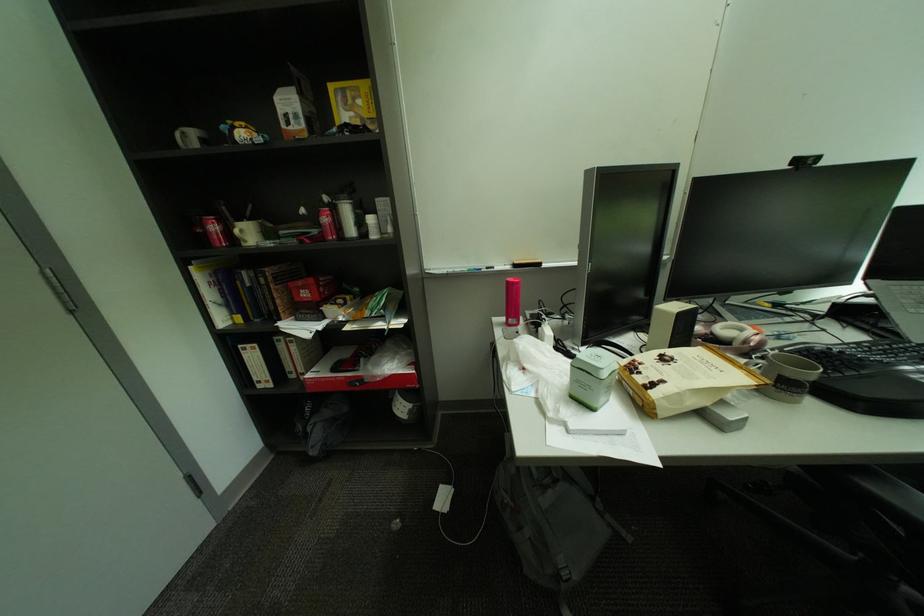
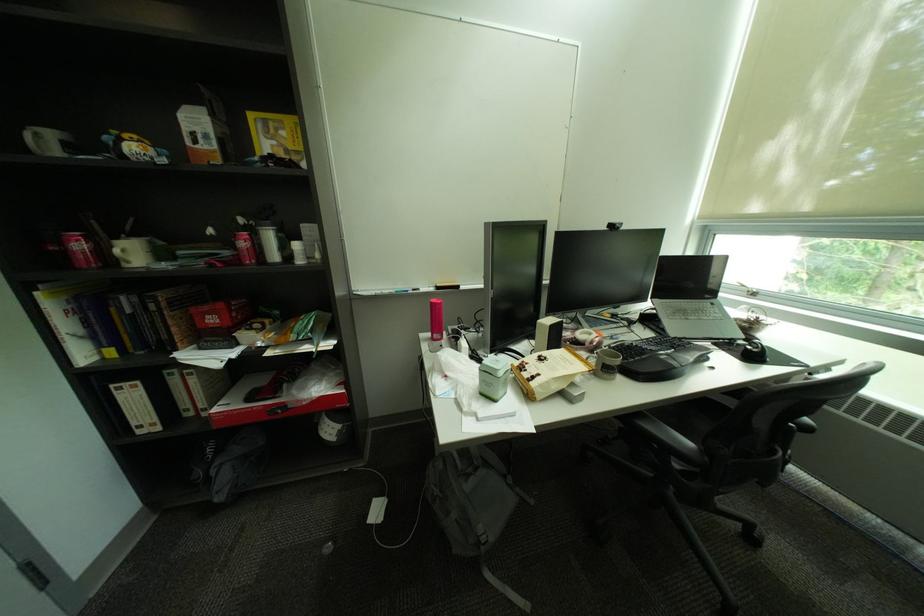
Find the pixel in the second image that matches [248,233] in the first image.

(128, 252)